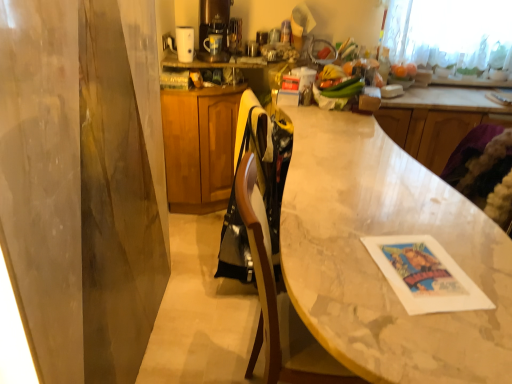
The width and height of the screenshot is (512, 384). What do you see at coordinates (199, 147) in the screenshot? I see `wooden cabinet at center` at bounding box center [199, 147].

What is the approximate width of wooden cabinet at center?

The width of wooden cabinet at center is 32.83 centimeters.

What do you see at coordinates (484, 171) in the screenshot? This screenshot has width=512, height=384. I see `purple fabric swivel chair at lower right` at bounding box center [484, 171].

Identify the location of white glossy coffee cup at upper center. (185, 43).

The width and height of the screenshot is (512, 384). What are the coordinates of `satin gold coffee machine at upper center` in the screenshot? It's located at (214, 28).

Describe the element at coordinates (214, 28) in the screenshot. I see `satin gold coffee machine at upper center` at that location.

At what (x,y) coordinates should I click in order to perform the action: click on marble at center. Please return your answer as a coordinate pair (x, y). The image size is (512, 384). Looking at the image, I should click on (374, 262).

What do you see at coordinates (374, 262) in the screenshot?
I see `marble at center` at bounding box center [374, 262].

Locate an element on the screen. wooden cabinet at center is located at coordinates (199, 147).

Would you say wooden cabinet at center is to the left or to the right of purple fabric swivel chair at lower right in the picture?

wooden cabinet at center is positioned on purple fabric swivel chair at lower right's left side.

Between wooden cabinet at center and purple fabric swivel chair at lower right, which one has larger width?

wooden cabinet at center.

From their relative heights in the image, would you say wooden cabinet at center is taller or shorter than purple fabric swivel chair at lower right?

In the image, wooden cabinet at center appears to be taller than purple fabric swivel chair at lower right.

Considering the sizes of objects wooden cabinet at center and purple fabric swivel chair at lower right in the image provided, who is smaller, wooden cabinet at center or purple fabric swivel chair at lower right?

Smaller between the two is purple fabric swivel chair at lower right.

Is wooden cabinet at center smaller than marble at center?

Yes, wooden cabinet at center is smaller than marble at center.

Is wooden cabinet at center to the right of marble at center from the viewer's perspective?

No.

In the scene shown: Is wooden cabinet at center not within marble at center?

Yes, wooden cabinet at center is located beyond the bounds of marble at center.

Is white glossy coffee cup at upper center aimed at wooden cabinet at center?

No, white glossy coffee cup at upper center is not facing towards wooden cabinet at center.

Can you confirm if white glossy coffee cup at upper center is bigger than wooden cabinet at center?

Incorrect, white glossy coffee cup at upper center is not larger than wooden cabinet at center.

How distant is white glossy coffee cup at upper center from wooden cabinet at center?

white glossy coffee cup at upper center and wooden cabinet at center are 20.61 inches apart from each other.

Between point (184, 29) and point (173, 194), which one is positioned behind?

Point (173, 194)

At what (x,y) coordinates should I click in order to perform the action: click on fruit behind the marble at center. Please return your answer as a coordinate pair (x, y). The width and height of the screenshot is (512, 384). Looking at the image, I should click on (404, 71).

Based on the photo, is smooth orange fruit at upper right in front of or behind marble at center in the image?

smooth orange fruit at upper right is behind marble at center.

From the image's perspective, which object appears higher, smooth orange fruit at upper right or marble at center?

smooth orange fruit at upper right is shown above in the image.

How many degrees apart are the facing directions of smooth orange fruit at upper right and marble at center?

smooth orange fruit at upper right and marble at center are facing 83 degrees away from each other.

Does smooth orange fruit at upper right come behind wooden cabinet at center?

Yes, the depth of smooth orange fruit at upper right is greater than that of wooden cabinet at center.

Could you tell me if smooth orange fruit at upper right is turned towards wooden cabinet at center?

No, smooth orange fruit at upper right is not oriented towards wooden cabinet at center.

Considering the points (403, 79) and (198, 95), which point is behind, point (403, 79) or point (198, 95)?

The point (403, 79) is behind.

Looking at this image, from a real-world perspective, is wooden cabinet at center located higher than white glossy coffee cup at upper center?

No, from a real-world perspective, wooden cabinet at center is not over white glossy coffee cup at upper center

Is wooden cabinet at center inside the boundaries of white glossy coffee cup at upper center, or outside?

The correct answer is: outside.

Can you confirm if wooden cabinet at center is positioned to the left of white glossy coffee cup at upper center?

No, wooden cabinet at center is not to the left of white glossy coffee cup at upper center.

Does wooden cabinet at center have a greater width compared to white glossy coffee cup at upper center?

Indeed, wooden cabinet at center has a greater width compared to white glossy coffee cup at upper center.

Is the depth of purple fabric swivel chair at lower right greater than that of smooth orange fruit at upper right?

No, purple fabric swivel chair at lower right is closer to the camera.

Can you confirm if purple fabric swivel chair at lower right is positioned to the right of smooth orange fruit at upper right?

Yes, purple fabric swivel chair at lower right is to the right of smooth orange fruit at upper right.

Which of these two, purple fabric swivel chair at lower right or smooth orange fruit at upper right, is smaller?

smooth orange fruit at upper right.

From the picture: Is purple fabric swivel chair at lower right oriented away from smooth orange fruit at upper right?

That's not correct — purple fabric swivel chair at lower right is not looking away from smooth orange fruit at upper right.

Locate an element on the screen. The height and width of the screenshot is (384, 512). cabinetry located underneath the purple fabric swivel chair at lower right (from a real-world perspective) is located at coordinates (199, 147).

I want to click on countertop that appears below the wooden cabinet at center (from the image's perspective), so click(374, 262).

Looking at the image, which one is located further to satin gold coffee machine at upper center, white glossy coffee cup at upper center or marble at center?

marble at center lies further to satin gold coffee machine at upper center than the other object.

Which object lies further to the anchor point purple fabric swivel chair at lower right, smooth orange fruit at upper right or wooden counter at upper right?

smooth orange fruit at upper right is positioned further to the anchor purple fabric swivel chair at lower right.

Looking at the image, which one is located closer to wooden counter at upper right, smooth orange fruit at upper right or wooden cabinet at center?

The object closer to wooden counter at upper right is smooth orange fruit at upper right.

Which object lies further to the anchor point purple fabric swivel chair at lower right, wooden cabinet at center or smooth orange fruit at upper right?

wooden cabinet at center is further to purple fabric swivel chair at lower right.

From the image, which object appears to be nearer to smooth orange fruit at upper right, marble at center or purple fabric swivel chair at lower right?

Among the two, purple fabric swivel chair at lower right is located nearer to smooth orange fruit at upper right.

Based on the photo, looking at the image, which one is located further to white glossy coffee cup at upper center, wooden counter at upper right or wooden cabinet at center?

Among the two, wooden counter at upper right is located further to white glossy coffee cup at upper center.

From the picture: Which object lies further to the anchor point purple fabric swivel chair at lower right, wooden cabinet at center or marble at center?

wooden cabinet at center is further to purple fabric swivel chair at lower right.

Estimate the real-world distances between objects in this image. Which object is further from smooth orange fruit at upper right, satin gold coffee machine at upper center or wooden counter at upper right?

satin gold coffee machine at upper center.

At what (x,y) coordinates should I click in order to perform the action: click on fruit between white glossy coffee cup at upper center and wooden counter at upper right from left to right. Please return your answer as a coordinate pair (x, y). Image resolution: width=512 pixels, height=384 pixels. Looking at the image, I should click on (404, 71).

You are a GUI agent. You are given a task and a screenshot of the screen. Output one action in this format:
    pyautogui.click(x=<x>, y=<y>)
    Task: Click on the cabinetry between marble at center and smooth orange fruit at upper right from front to back
    
    Given the screenshot: What is the action you would take?
    pyautogui.click(x=199, y=147)

Where is `coffee machine located between wooden cabinet at center and smooth orange fruit at upper right in the left-right direction`? This screenshot has width=512, height=384. coffee machine located between wooden cabinet at center and smooth orange fruit at upper right in the left-right direction is located at coordinates (214, 28).

In order to click on appliance between marble at center and wooden cabinet at center from front to back in this screenshot , I will do click(x=185, y=43).